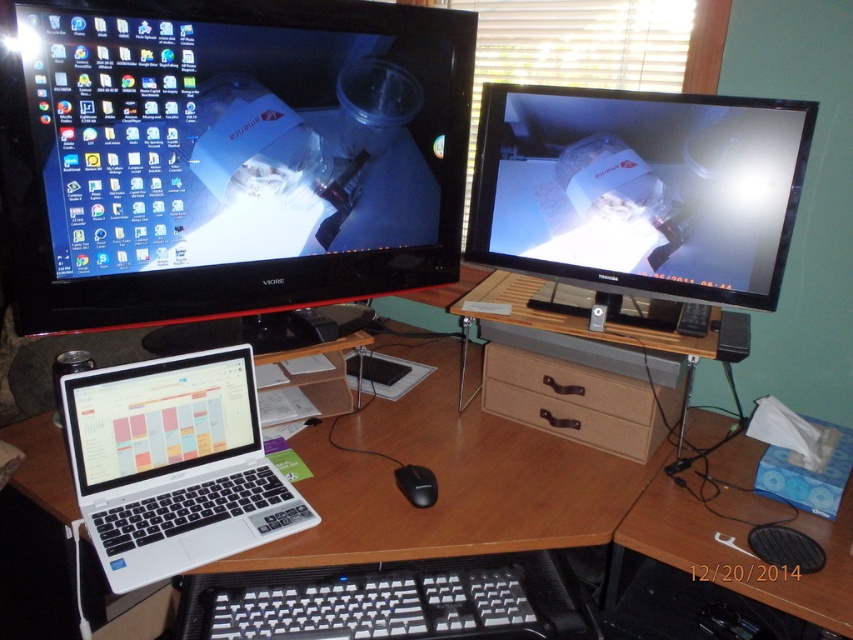
Who is positioned more to the left, white plastic laptop at lower left or blue cardboard tissue box at lower right?

white plastic laptop at lower left

You are a GUI agent. You are given a task and a screenshot of the screen. Output one action in this format:
    pyautogui.click(x=<x>, y=<y>)
    Task: Click on the white plastic laptop at lower left
    This screenshot has width=853, height=640.
    Given the screenshot: What is the action you would take?
    pyautogui.click(x=173, y=465)

Identify the location of white plastic laptop at lower left. The image size is (853, 640). (173, 465).

Can you confirm if matte black monitor at upper left is positioned to the left of brown leather drawer at lower center?

Indeed, matte black monitor at upper left is positioned on the left side of brown leather drawer at lower center.

Is matte black monitor at upper left below brown leather drawer at lower center?

Actually, matte black monitor at upper left is above brown leather drawer at lower center.

Is point (273, 268) positioned before point (596, 420)?

Yes, it is.

Identify the location of matte black monitor at upper left. This screenshot has width=853, height=640. (228, 156).

Is matte black monitor at upper left below white plastic laptop at lower left?

No, matte black monitor at upper left is not below white plastic laptop at lower left.

Is point (253, 182) positioned in front of point (74, 413)?

No.

Locate an element on the screen. Image resolution: width=853 pixels, height=640 pixels. matte black monitor at upper left is located at coordinates (228, 156).